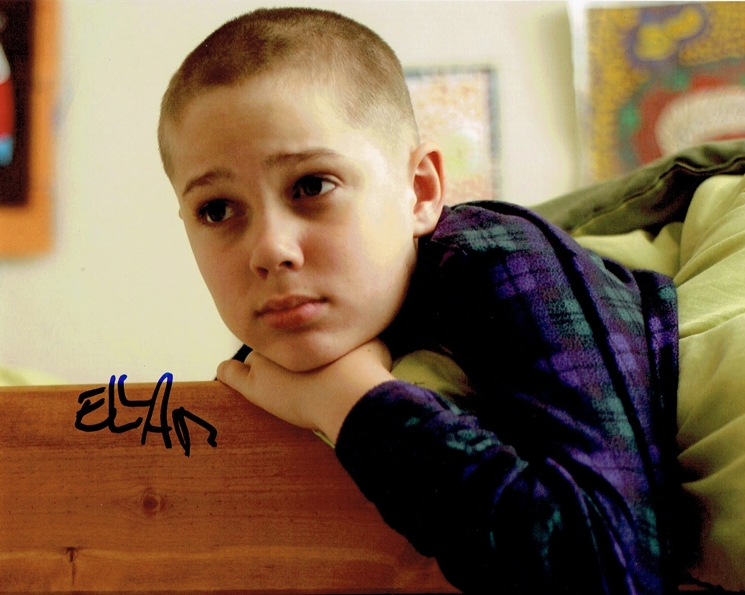
Where is `wood bed`? wood bed is located at coordinates (247, 456), (173, 502), (50, 502).